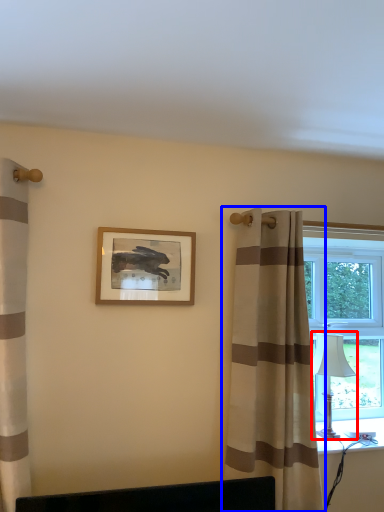
Question: Among these objects, which one is nearest to the camera, table lamp (highlighted by a red box) or curtain (highlighted by a blue box)?

Choices:
 (A) table lamp
 (B) curtain

Answer: (B)